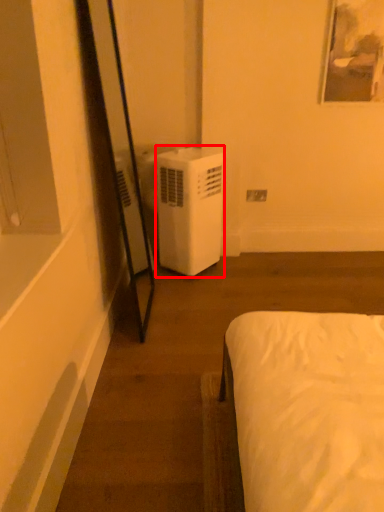
Question: From the image's perspective, what is the correct spatial positioning of air conditioner (annotated by the red box) in reference to electric outlet?

Choices:
 (A) above
 (B) below

Answer: (B)